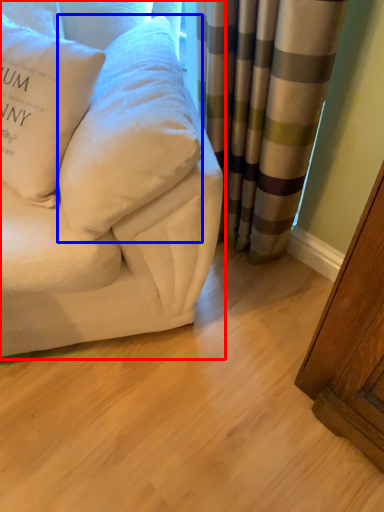
Question: Which object is closer to the camera taking this photo, studio couch (highlighted by a red box) or pillow (highlighted by a blue box)?

Choices:
 (A) studio couch
 (B) pillow

Answer: (A)